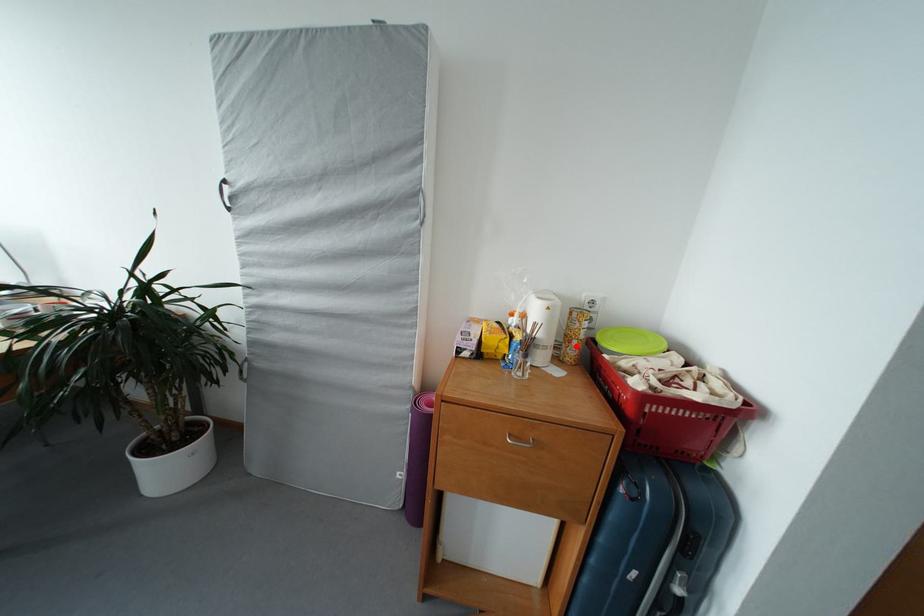
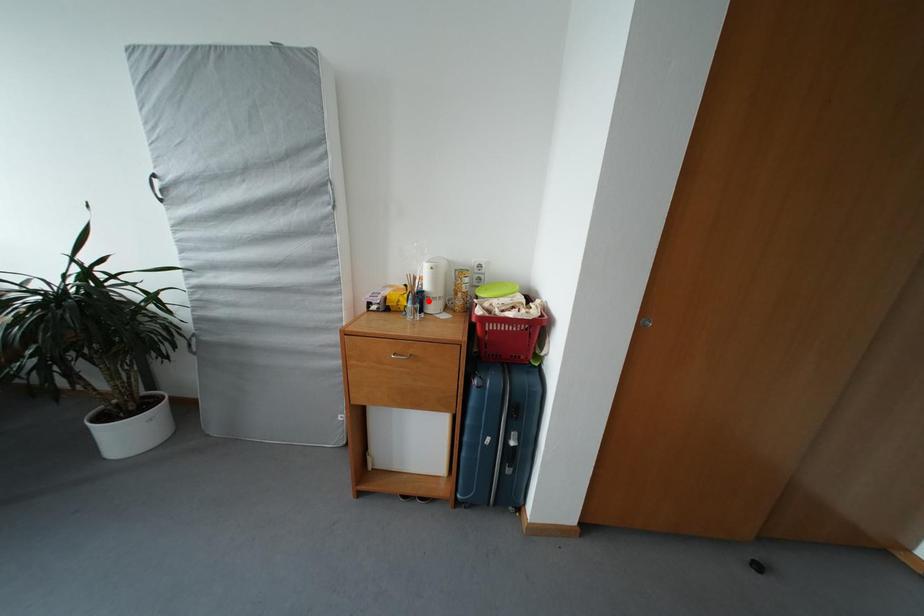
I am providing you with two images of the same scene from different viewpoints. A red point is marked on the first image and another point is marked on the second image. Does the point marked in image1 correspond to the same location as the one in image2?

No